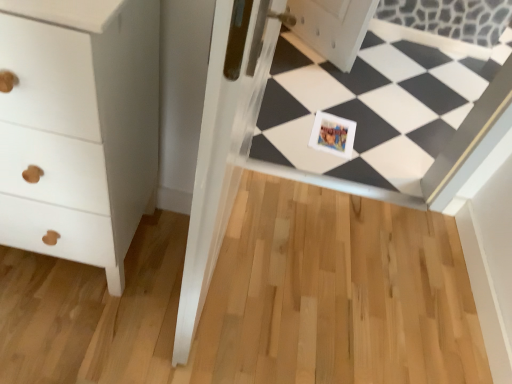
Question: From a real-world perspective, is printed paper postcard at center positioned under white matte chest of drawers at left based on gravity?

Choices:
 (A) no
 (B) yes

Answer: (B)

Question: Is printed paper postcard at center positioned with its back to white matte chest of drawers at left?

Choices:
 (A) no
 (B) yes

Answer: (A)

Question: Is printed paper postcard at center not near white matte chest of drawers at left?

Choices:
 (A) no
 (B) yes

Answer: (B)

Question: Are printed paper postcard at center and white matte chest of drawers at left beside each other?

Choices:
 (A) yes
 (B) no

Answer: (B)

Question: Does printed paper postcard at center appear on the left side of white matte chest of drawers at left?

Choices:
 (A) yes
 (B) no

Answer: (B)

Question: From the image's perspective, is printed paper postcard at center over white matte chest of drawers at left?

Choices:
 (A) no
 (B) yes

Answer: (B)

Question: Considering the relative sizes of white matte chest of drawers at left and white glossy frame at center in the image provided, is white matte chest of drawers at left shorter than white glossy frame at center?

Choices:
 (A) no
 (B) yes

Answer: (A)

Question: Is the position of white matte chest of drawers at left less distant than that of white glossy frame at center?

Choices:
 (A) no
 (B) yes

Answer: (B)

Question: Is white matte chest of drawers at left wider than white glossy frame at center?

Choices:
 (A) no
 (B) yes

Answer: (B)

Question: Considering the relative positions of white matte chest of drawers at left and white glossy frame at center in the image provided, is white matte chest of drawers at left to the right of white glossy frame at center from the viewer's perspective?

Choices:
 (A) yes
 (B) no

Answer: (B)

Question: Does white matte chest of drawers at left contain white glossy frame at center?

Choices:
 (A) no
 (B) yes

Answer: (A)

Question: Can you confirm if white matte chest of drawers at left is thinner than white glossy frame at center?

Choices:
 (A) yes
 (B) no

Answer: (B)

Question: Is white glossy frame at center positioned beyond the bounds of white matte chest of drawers at left?

Choices:
 (A) yes
 (B) no

Answer: (A)